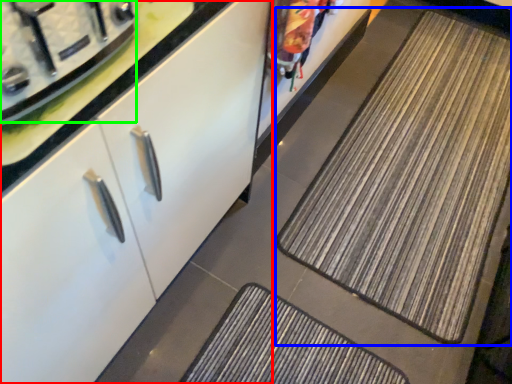
Question: Estimate the real-world distances between objects in this image. Which object is farther from cabinetry (highlighted by a red box), mat (highlighted by a blue box) or appliance (highlighted by a green box)?

Choices:
 (A) mat
 (B) appliance

Answer: (A)